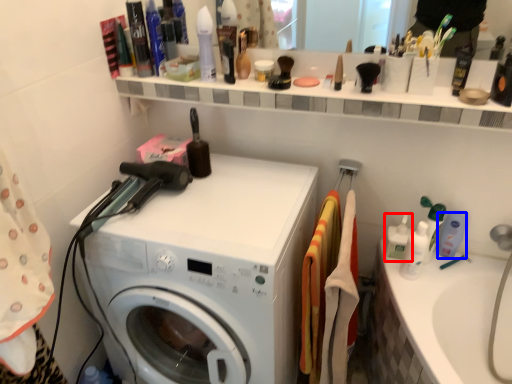
Question: Among these objects, which one is nearest to the camera, cleaning product (highlighted by a red box) or cleaning product (highlighted by a blue box)?

Choices:
 (A) cleaning product
 (B) cleaning product

Answer: (A)